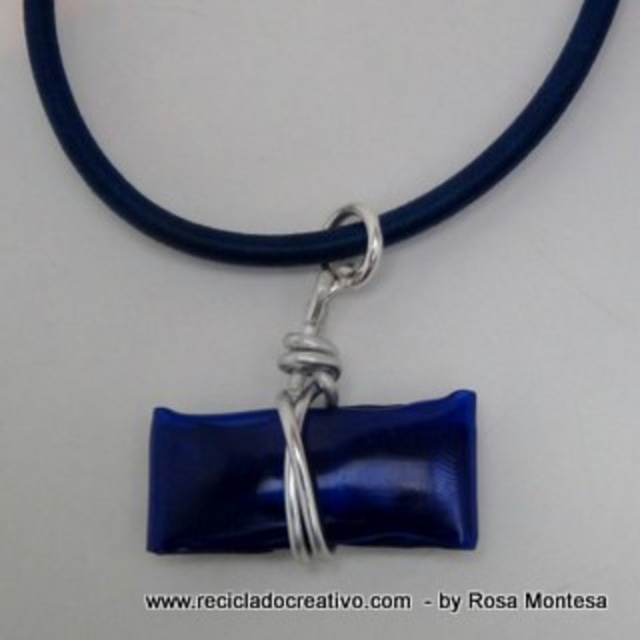
You are a jeweler examining the necklace. You need to determine which part of the necklace has a larger width between the glossy blue glass at center and the glossy blue glass pendant at center. Which one is wider?

The glossy blue glass at center is wider than the glossy blue glass pendant at center.

You are a jeweler who needs to ensure proper spacing between two glossy blue glass pieces on a necklace. The necklace has a glossy blue glass at center and a glossy blue glass pendant at center. According to the design specifications, the minimum required distance between these two components is 10 centimeters. Does the current spacing meet this requirement?

The distance between the glossy blue glass at center and the glossy blue glass pendant at center is 10.75 centimeters, which exceeds the minimum required 10 centimeters. Therefore, the current spacing meets the design specifications.